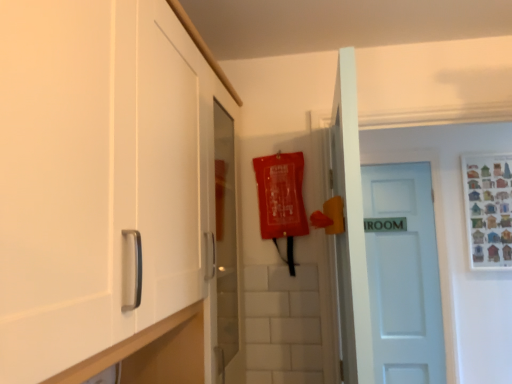
Question: In the image, is white matte door at center on the left side or the right side of white matte cabinet at left?

Choices:
 (A) left
 (B) right

Answer: (B)

Question: Is white matte door at center spatially inside white matte cabinet at left, or outside of it?

Choices:
 (A) outside
 (B) inside

Answer: (A)

Question: In terms of height, does white matte door at center look taller or shorter compared to white matte cabinet at left?

Choices:
 (A) short
 (B) tall

Answer: (B)

Question: In terms of width, does white matte cabinet at left look wider or thinner when compared to white matte door at center?

Choices:
 (A) thin
 (B) wide

Answer: (B)

Question: In the image, is white matte cabinet at left positioned in front of or behind white matte door at center?

Choices:
 (A) behind
 (B) front

Answer: (B)

Question: Is point click(57, 284) closer or farther from the camera than point click(365, 196)?

Choices:
 (A) closer
 (B) farther

Answer: (A)

Question: From a real-world perspective, relative to white matte door at center, is white matte cabinet at left vertically above or below?

Choices:
 (A) below
 (B) above

Answer: (B)